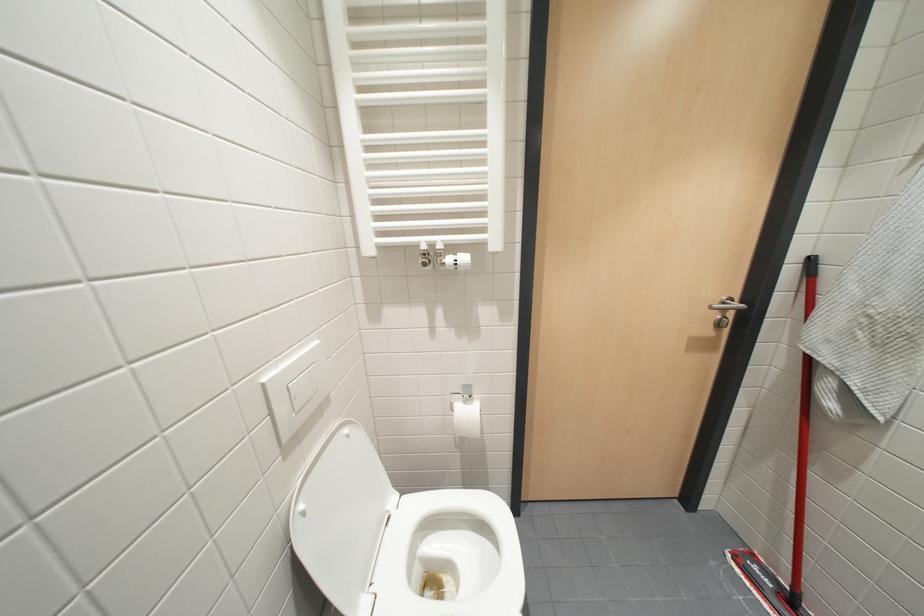
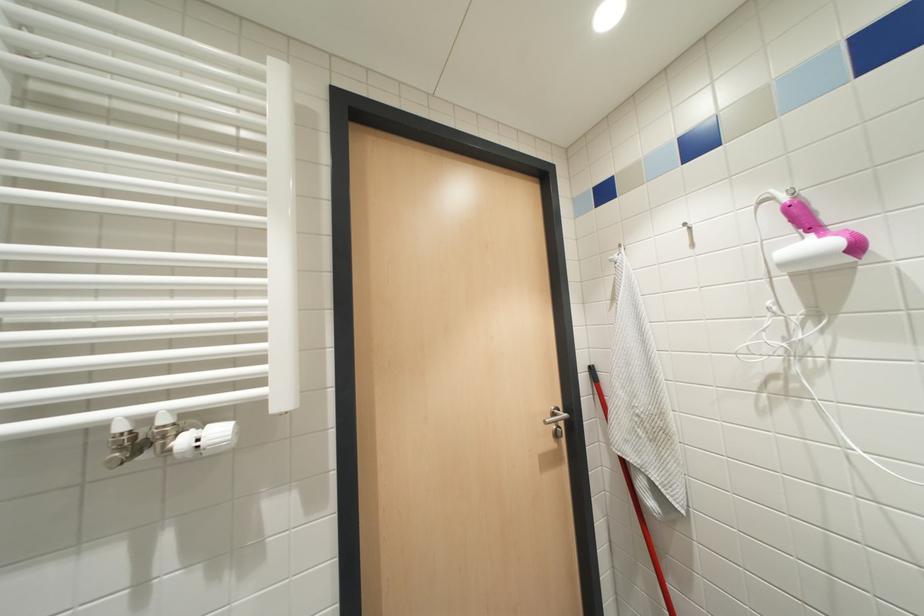
Based on the continuous images, in which direction is the camera rotating?

The camera rotated toward right-up.